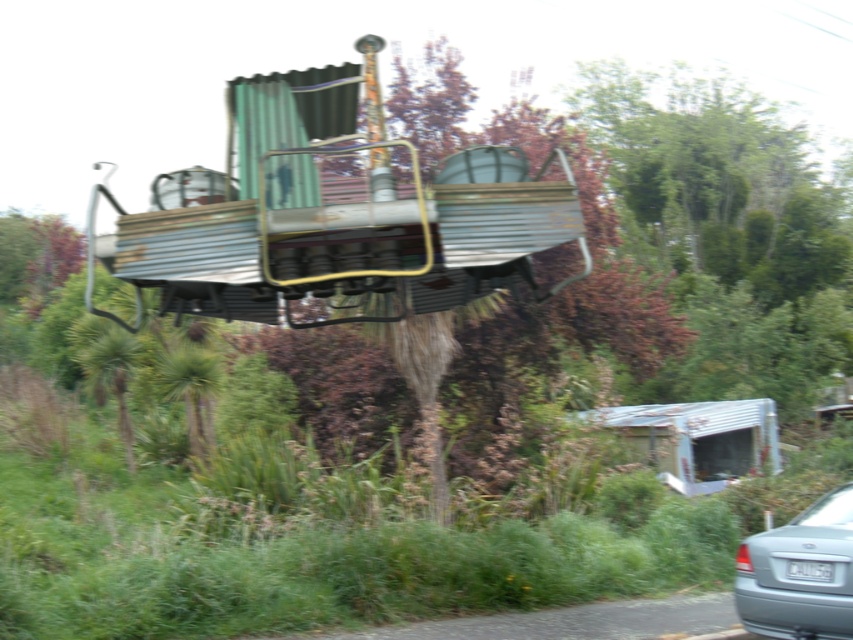
You are standing in front of the corrugated metal train car at center and the silver metallic car at lower right. Which object is closer to you?

Result: The corrugated metal train car at center is closer to you because it is further to the viewer than the silver metallic car at lower right.

Looking at this image, you are planning to transport a large piece of equipment that is 3 meters wide. You have two options available in the scene, the corrugated metal train car at center and the silver metallic car at lower right. Which one would be more suitable for transporting this equipment based on their widths?

The silver metallic car at lower right has a greater width than the corrugated metal train car at center, making it more suitable for transporting the large 3 meter wide equipment.

You are standing at the point with coordinates (334,221). What object is located exactly at your current position?

The point at coordinates (334,221) is the location of the corrugated metal train car at center.